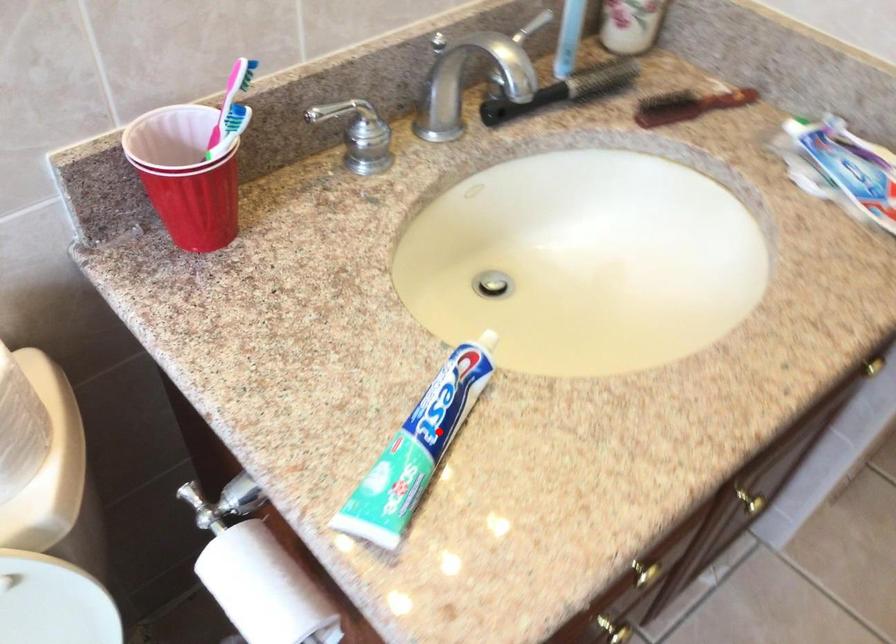
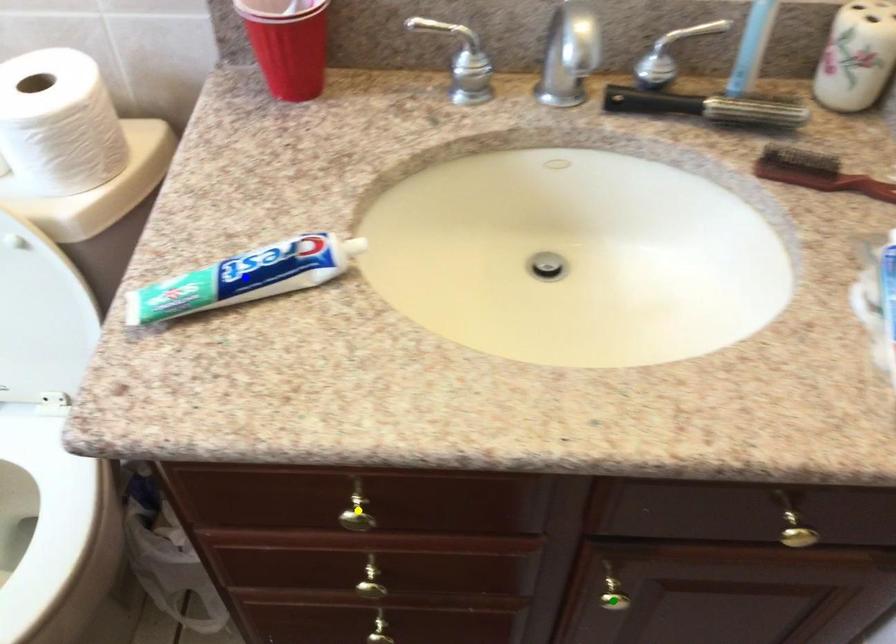
Question: I am providing you with two images of the same scene from different viewpoints. A red point is marked on the first image. You are given multiple points on the second image. Which point in image 2 represents the same 3d spot as the red point in image 1?

Choices:
 (A) yellow point
 (B) blue point
 (C) green point

Answer: (B)